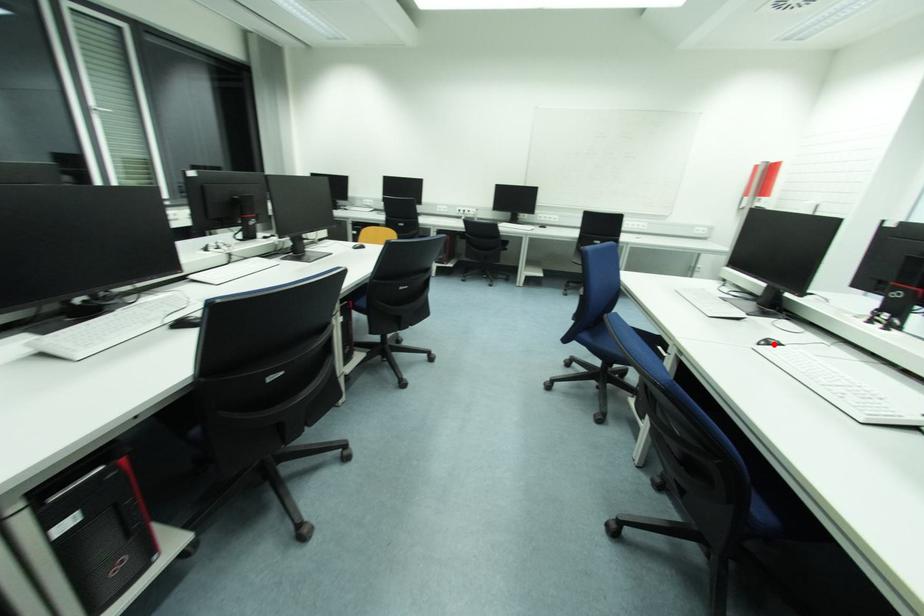
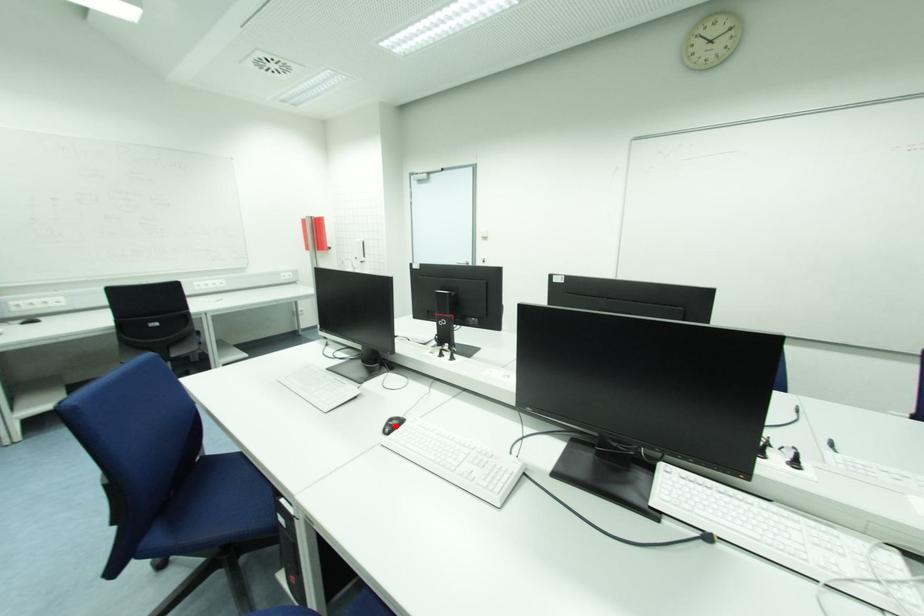
I am providing you with two images of the same scene from different viewpoints. A red point is marked on the first image and another point is marked on the second image. Does the point marked in image1 correspond to the same location as the one in image2?

Yes